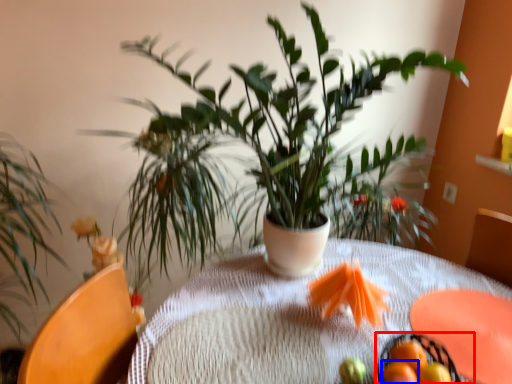
Question: Which of the following is the closest to the observer, basket (highlighted by a red box) or tangerine (highlighted by a blue box)?

Choices:
 (A) basket
 (B) tangerine

Answer: (A)